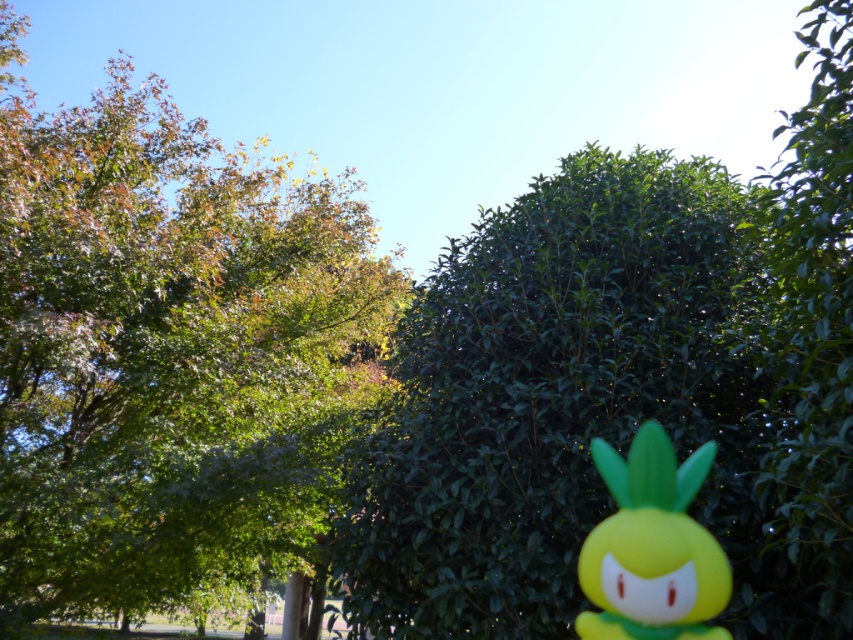
Question: Is green leafy tree at upper left wider than yellow matte toy at right?

Choices:
 (A) yes
 (B) no

Answer: (B)

Question: Does green leafy hedge at center appear on the left side of yellow matte toy at right?

Choices:
 (A) yes
 (B) no

Answer: (A)

Question: Which is farther from the yellow matte toy at right?

Choices:
 (A) green leafy tree at upper left
 (B) green leafy tree at right

Answer: (A)

Question: Among these objects, which one is farthest from the camera?

Choices:
 (A) green leafy tree at upper left
 (B) green leafy hedge at center
 (C) yellow matte toy at right

Answer: (A)

Question: Does green leafy tree at upper left appear on the left side of green leafy tree at right?

Choices:
 (A) no
 (B) yes

Answer: (B)

Question: Among these objects, which one is nearest to the camera?

Choices:
 (A) green leafy tree at upper left
 (B) green leafy tree at right
 (C) yellow matte toy at right
 (D) green leafy hedge at center

Answer: (B)